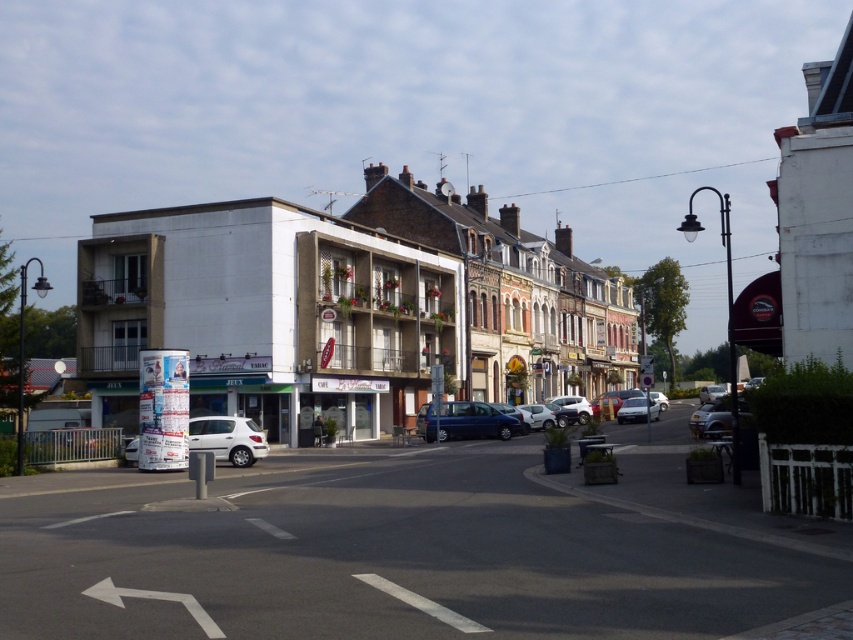
Question: Where is white concrete building at center located in relation to metallic blue van at center in the image?

Choices:
 (A) left
 (B) right

Answer: (B)

Question: Which of these objects is positioned closest to the white matte car at lower left?

Choices:
 (A) white concrete building at center
 (B) metallic blue van at center

Answer: (B)

Question: Is white matte car at center thinner than silver metallic sedan at center-right?

Choices:
 (A) yes
 (B) no

Answer: (B)

Question: Which point appears closest to the camera in this image?

Choices:
 (A) (451, 403)
 (B) (637, 417)
 (C) (138, 442)
 (D) (387, 252)

Answer: (C)

Question: Is white matte car at lower left above silver metallic sedan at center-right?

Choices:
 (A) yes
 (B) no

Answer: (A)

Question: Which of the following is the closest to the observer?

Choices:
 (A) (519, 506)
 (B) (637, 408)

Answer: (A)